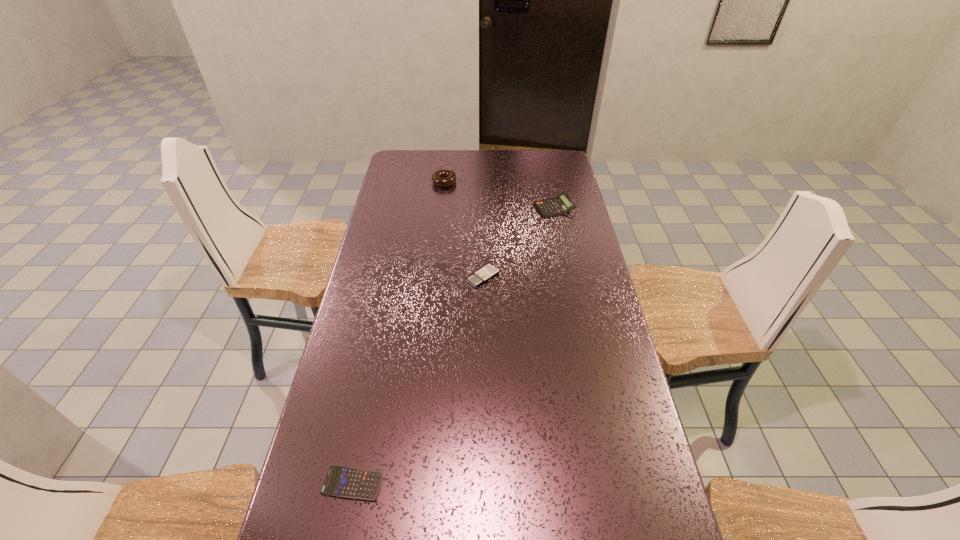
Image resolution: width=960 pixels, height=540 pixels. In order to click on object that is the closest to the farthest object in this screenshot , I will do `click(561, 204)`.

Image resolution: width=960 pixels, height=540 pixels. In order to click on calculator identified as the second closest to the farthest calculator in this screenshot , I will do `click(340, 481)`.

Find the location of `calculator that is the closest to the rightmost calculator`. calculator that is the closest to the rightmost calculator is located at coordinates (487, 272).

Where is `vacant area in the image that satisfies the following two spatial constraints: 1. on the back side of the second object from right to left; 2. on the right side of the nearest object`? vacant area in the image that satisfies the following two spatial constraints: 1. on the back side of the second object from right to left; 2. on the right side of the nearest object is located at coordinates (394, 277).

The height and width of the screenshot is (540, 960). In order to click on free spot that satisfies the following two spatial constraints: 1. on the back side of the shortest calculator; 2. on the left side of the farthest object in this screenshot , I will do `click(413, 182)`.